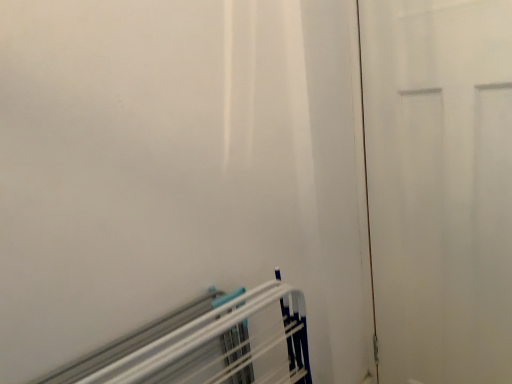
This screenshot has width=512, height=384. I want to click on white matte door at right, so pyautogui.click(x=439, y=187).

Describe the element at coordinates (439, 187) in the screenshot. I see `white matte door at right` at that location.

Where is `white matte door at right`? The image size is (512, 384). white matte door at right is located at coordinates (439, 187).